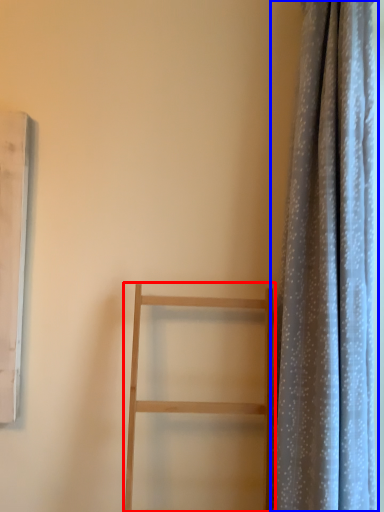
Question: Which object appears farthest to the camera in this image, furniture (highlighted by a red box) or curtain (highlighted by a blue box)?

Choices:
 (A) furniture
 (B) curtain

Answer: (B)